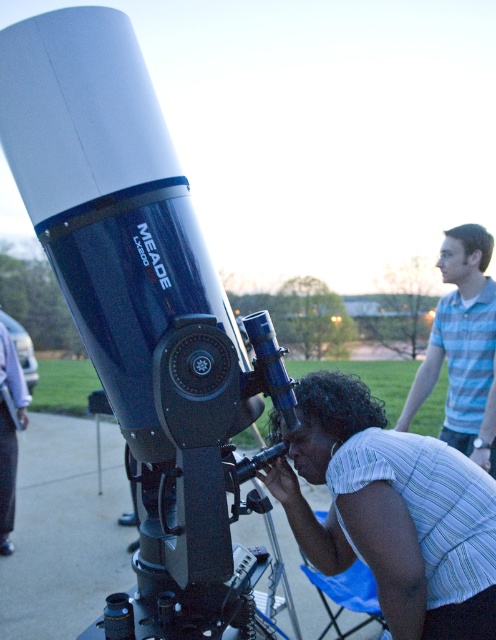
Can you confirm if matte black telescope at center is thinner than brushed metal jacket at lower left?

No, matte black telescope at center is not thinner than brushed metal jacket at lower left.

Can you confirm if matte black telescope at center is taller than brushed metal jacket at lower left?

Correct, matte black telescope at center is much taller as brushed metal jacket at lower left.

Between point (187, 387) and point (2, 397), which one is positioned in front?

Positioned in front is point (187, 387).

This screenshot has height=640, width=496. I want to click on matte black telescope at center, so click(x=142, y=314).

Which is below, white striped shirt at center or blue striped shirt at upper right?

white striped shirt at center is lower down.

Can you confirm if white striped shirt at center is wider than blue striped shirt at upper right?

Yes.

Image resolution: width=496 pixels, height=640 pixels. I want to click on white striped shirt at center, so click(x=390, y=509).

Between matte black telescope at center and white striped shirt at center, which one appears on the left side from the viewer's perspective?

Positioned to the left is matte black telescope at center.

Is matte black telescope at center further to camera compared to white striped shirt at center?

No.

Locate an element on the screen. The width and height of the screenshot is (496, 640). matte black telescope at center is located at coordinates (142, 314).

In order to click on matte black telescope at center in this screenshot , I will do `click(142, 314)`.